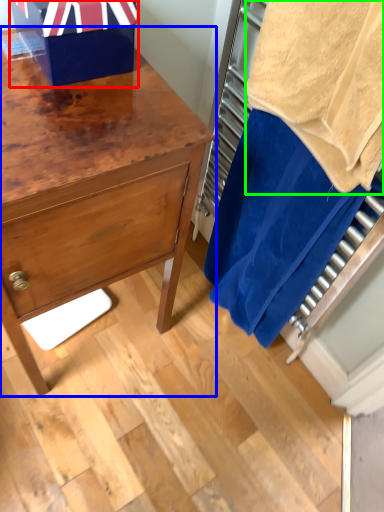
Question: Estimate the real-world distances between objects in this image. Which object is closer to gift box (highlighted by a red box), chest of drawers (highlighted by a blue box) or bath towel (highlighted by a green box)?

Choices:
 (A) chest of drawers
 (B) bath towel

Answer: (A)